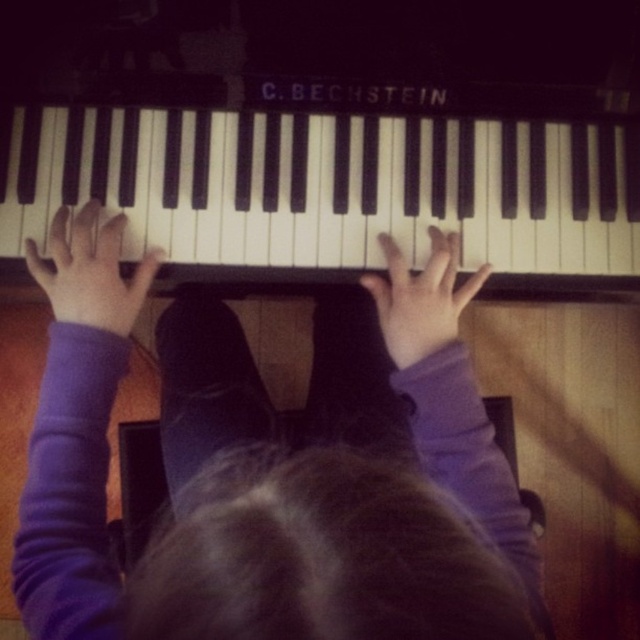
Can you confirm if purple fabric hands at center is positioned below purple soft hand at center?

Correct, purple fabric hands at center is located below purple soft hand at center.

Based on the photo, how far apart are purple fabric hands at center and purple soft hand at center?

A distance of 7.12 inches exists between purple fabric hands at center and purple soft hand at center.

The image size is (640, 640). Identify the location of purple fabric hands at center. (266, 476).

Where is `purple fabric hands at center`? Image resolution: width=640 pixels, height=640 pixels. purple fabric hands at center is located at coordinates click(266, 476).

In the scene shown: Between black polished piano at center and purple matte hand at center, which one has more height?

With more height is black polished piano at center.

Does point (348, 168) lie in front of point (456, 246)?

No, (348, 168) is behind (456, 246).

Who is more forward, [284,280] or [428,276]?

Point [428,276]

Where is `black polished piano at center`? This screenshot has width=640, height=640. black polished piano at center is located at coordinates (337, 182).

Which is above, purple fabric hands at center or black polished piano at center?

black polished piano at center is above.

Is purple fabric hands at center above black polished piano at center?

Actually, purple fabric hands at center is below black polished piano at center.

Locate an element on the screen. Image resolution: width=640 pixels, height=640 pixels. purple fabric hands at center is located at coordinates (266, 476).